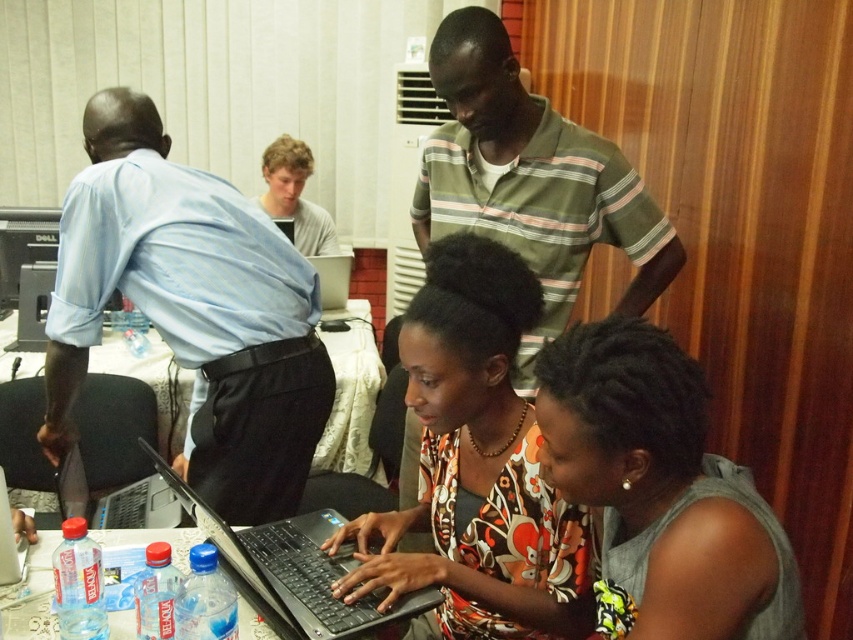
Is floral print blouse at center wider than black plastic laptop at lower center?

In fact, floral print blouse at center might be narrower than black plastic laptop at lower center.

Can you confirm if floral print blouse at center is positioned to the right of black plastic laptop at lower center?

Yes, floral print blouse at center is to the right of black plastic laptop at lower center.

Locate an element on the screen. The image size is (853, 640). floral print blouse at center is located at coordinates (660, 490).

The width and height of the screenshot is (853, 640). I want to click on floral print blouse at center, so click(660, 490).

Who is more forward, (245, 636) or (347, 257)?

Point (245, 636) is more forward.

Between clear plastic bottles at lower left and silver metallic laptop at center, which one is positioned higher?

silver metallic laptop at center is above.

Is point (30, 545) positioned before point (326, 301)?

That is True.

I want to click on clear plastic bottles at lower left, so (x=32, y=595).

Does clear plastic bottles at lower left lie behind light brown hair at upper center?

That is False.

Does clear plastic bottles at lower left have a smaller size compared to light brown hair at upper center?

Yes.

Between point (195, 529) and point (306, 172), which one is positioned behind?

The point (306, 172) is behind.

Identify the location of clear plastic bottles at lower left. (32, 595).